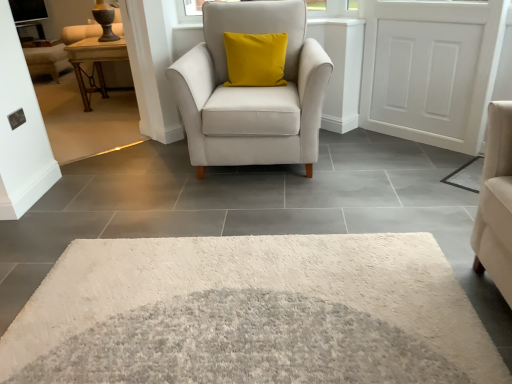
Question: Is matte brown wooden couch at upper left wider than matte white armchair at center?

Choices:
 (A) no
 (B) yes

Answer: (A)

Question: Is matte brown wooden couch at upper left bigger than matte white armchair at center?

Choices:
 (A) no
 (B) yes

Answer: (A)

Question: Can you confirm if matte brown wooden couch at upper left is positioned to the right of matte white armchair at center?

Choices:
 (A) yes
 (B) no

Answer: (B)

Question: Considering the relative positions of matte brown wooden couch at upper left and matte white armchair at center in the image provided, is matte brown wooden couch at upper left in front of matte white armchair at center?

Choices:
 (A) no
 (B) yes

Answer: (A)

Question: From a real-world perspective, is matte brown wooden couch at upper left located beneath matte white armchair at center?

Choices:
 (A) no
 (B) yes

Answer: (A)

Question: Is woodenwoodentable at left bigger or smaller than white wood door at upper right?

Choices:
 (A) small
 (B) big

Answer: (B)

Question: Based on their positions, is woodenwoodentable at left located to the left or right of white wood door at upper right?

Choices:
 (A) left
 (B) right

Answer: (A)

Question: Considering the positions of woodenwoodentable at left and white wood door at upper right in the image, is woodenwoodentable at left taller or shorter than white wood door at upper right?

Choices:
 (A) tall
 (B) short

Answer: (B)

Question: Considering their positions, is woodenwoodentable at left located in front of or behind white wood door at upper right?

Choices:
 (A) front
 (B) behind

Answer: (B)

Question: In the image, is white wood door at upper right on the left side or the right side of matte brown wooden couch at upper left?

Choices:
 (A) right
 (B) left

Answer: (A)

Question: Is point (417, 64) positioned closer to the camera than point (89, 29)?

Choices:
 (A) closer
 (B) farther

Answer: (A)

Question: Is white wood door at upper right wider or thinner than matte brown wooden couch at upper left?

Choices:
 (A) thin
 (B) wide

Answer: (A)

Question: From the image's perspective, is white wood door at upper right above or below matte brown wooden couch at upper left?

Choices:
 (A) below
 (B) above

Answer: (A)

Question: Looking at the image, does white shaggy rug at lower right seem bigger or smaller compared to transparent glass window screen at upper left?

Choices:
 (A) big
 (B) small

Answer: (B)

Question: Considering the relative positions of white shaggy rug at lower right and transparent glass window screen at upper left in the image provided, is white shaggy rug at lower right to the left or to the right of transparent glass window screen at upper left?

Choices:
 (A) right
 (B) left

Answer: (A)